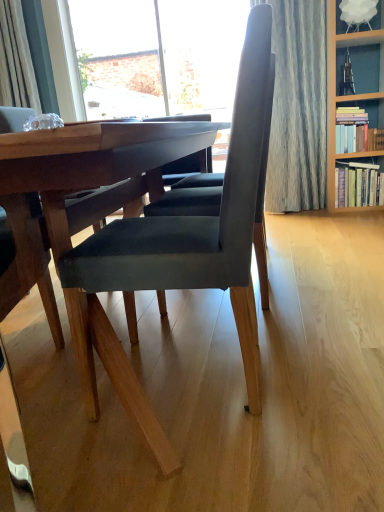
Question: Would you say hardcover book at right, the second book in the top-to-bottom sequence, is part of velvet dark gray chair at center's contents?

Choices:
 (A) yes
 (B) no

Answer: (B)

Question: From the image's perspective, would you say velvet dark gray chair at center is positioned over hardcover book at right, the 1th book from the bottom?

Choices:
 (A) no
 (B) yes

Answer: (A)

Question: Considering the relative positions of velvet dark gray chair at center and hardcover book at right, the second book in the top-to-bottom sequence, in the image provided, is velvet dark gray chair at center in front of hardcover book at right, the second book in the top-to-bottom sequence,?

Choices:
 (A) no
 (B) yes

Answer: (B)

Question: Considering the relative sizes of velvet dark gray chair at center and hardcover book at right, the second book in the top-to-bottom sequence, in the image provided, is velvet dark gray chair at center smaller than hardcover book at right, the second book in the top-to-bottom sequence,?

Choices:
 (A) yes
 (B) no

Answer: (B)

Question: Considering the relative sizes of velvet dark gray chair at center and hardcover book at right, the 1th book from the bottom, in the image provided, is velvet dark gray chair at center bigger than hardcover book at right, the 1th book from the bottom,?

Choices:
 (A) yes
 (B) no

Answer: (A)

Question: Is velvet dark gray chair at center taller than hardcover book at right, the 1th book from the bottom?

Choices:
 (A) no
 (B) yes

Answer: (B)

Question: Is the position of brick wall at upper left less distant than that of hardcover book at right, the second book in the top-to-bottom sequence?

Choices:
 (A) no
 (B) yes

Answer: (A)

Question: From a real-world perspective, is brick wall at upper left over hardcover book at right, the second book in the top-to-bottom sequence?

Choices:
 (A) no
 (B) yes

Answer: (B)

Question: Is brick wall at upper left behind hardcover book at right, the second book in the top-to-bottom sequence?

Choices:
 (A) no
 (B) yes

Answer: (B)

Question: Is brick wall at upper left to the left of hardcover book at right, the 1th book from the bottom, from the viewer's perspective?

Choices:
 (A) no
 (B) yes

Answer: (B)

Question: Does brick wall at upper left have a lesser width compared to hardcover book at right, the second book in the top-to-bottom sequence?

Choices:
 (A) no
 (B) yes

Answer: (B)

Question: Is brick wall at upper left aimed at hardcover book at right, the 1th book from the bottom?

Choices:
 (A) no
 (B) yes

Answer: (A)

Question: Does hardcover book at right, the 1th book from the bottom, appear on the right side of velvet dark gray chair at center?

Choices:
 (A) yes
 (B) no

Answer: (A)